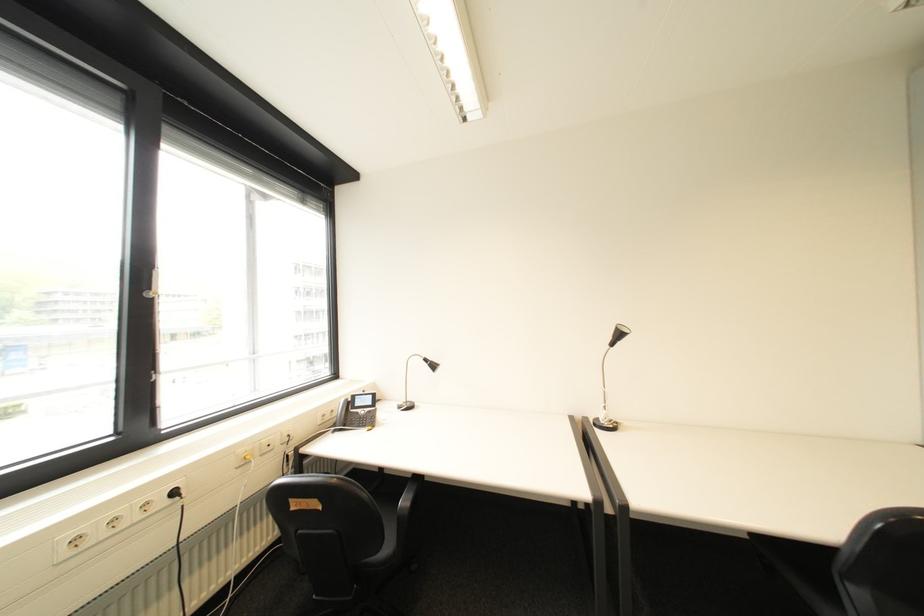
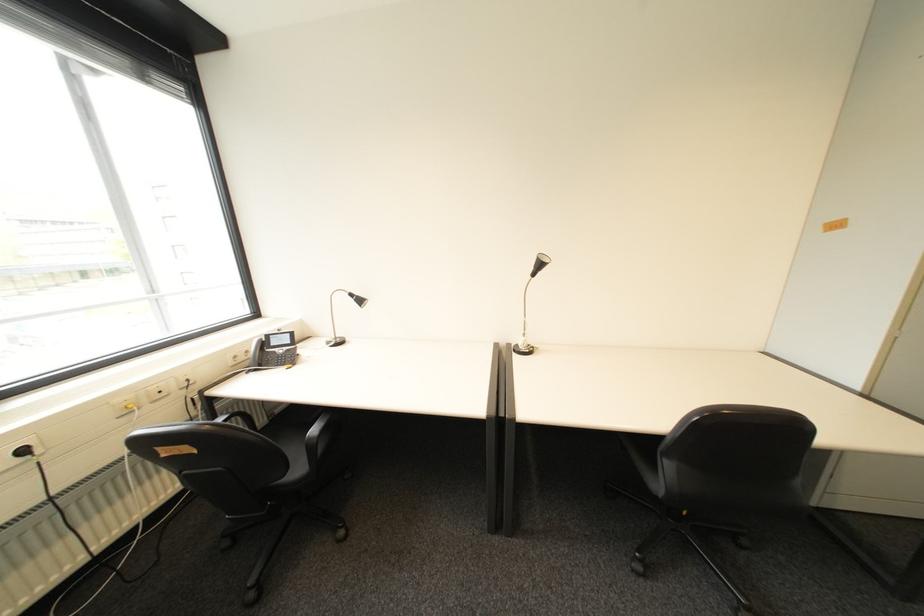
Locate, in the second image, the point that corresponds to pixel 185 493 in the first image.

(34, 452)